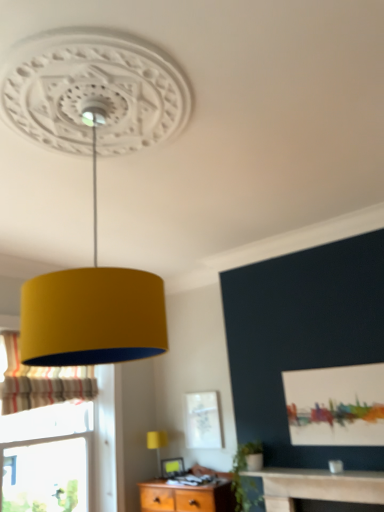
Question: From the image's perspective, would you say matte yellow lampshade at lower center is positioned over matte white picture frame at lower center?

Choices:
 (A) yes
 (B) no

Answer: (A)

Question: Can you confirm if matte yellow lampshade at lower center is smaller than matte white picture frame at lower center?

Choices:
 (A) no
 (B) yes

Answer: (A)

Question: Is matte yellow lampshade at lower center at the right side of matte white picture frame at lower center?

Choices:
 (A) no
 (B) yes

Answer: (A)

Question: Are matte yellow lampshade at lower center and matte white picture frame at lower center beside each other?

Choices:
 (A) yes
 (B) no

Answer: (B)

Question: Does matte yellow lampshade at lower center have a greater height compared to matte white picture frame at lower center?

Choices:
 (A) yes
 (B) no

Answer: (A)

Question: Is point (162, 432) closer or farther from the camera than point (8, 350)?

Choices:
 (A) farther
 (B) closer

Answer: (A)

Question: Is matte yellow lampshade at lower center wider or thinner than striped fabric curtain at left?

Choices:
 (A) thin
 (B) wide

Answer: (B)

Question: Considering their positions, is matte yellow lampshade at lower center located in front of or behind striped fabric curtain at left?

Choices:
 (A) behind
 (B) front

Answer: (A)

Question: From a real-world perspective, relative to striped fabric curtain at left, is matte yellow lampshade at lower center vertically above or below?

Choices:
 (A) above
 (B) below

Answer: (B)

Question: Is matte white picture frame at lower center situated inside matte yellow lampshade at lower center or outside?

Choices:
 (A) inside
 (B) outside

Answer: (B)

Question: In terms of size, does matte white picture frame at lower center appear bigger or smaller than matte yellow lampshade at lower center?

Choices:
 (A) big
 (B) small

Answer: (B)

Question: Does point (177, 460) appear closer or farther from the camera than point (155, 436)?

Choices:
 (A) farther
 (B) closer

Answer: (B)

Question: Looking at their shapes, would you say matte white picture frame at lower center is wider or thinner than matte yellow lampshade at lower center?

Choices:
 (A) wide
 (B) thin

Answer: (B)

Question: Relative to matte white picture frame at lower center, is matte yellow lampshade at lower center in front or behind?

Choices:
 (A) behind
 (B) front

Answer: (B)

Question: Looking at their shapes, would you say matte yellow lampshade at lower center is wider or thinner than matte white picture frame at lower center?

Choices:
 (A) thin
 (B) wide

Answer: (B)